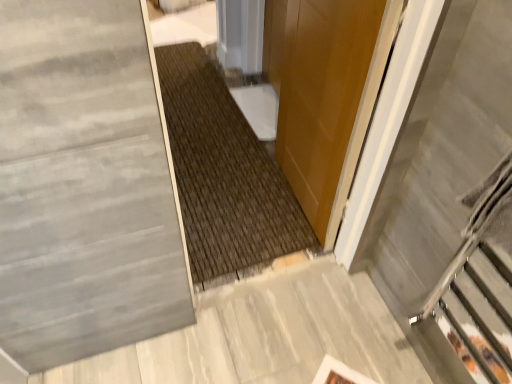
Measure the distance between point (298, 281) and camera.

The depth of point (298, 281) is 1.65 meters.

The image size is (512, 384). What do you see at coordinates (325, 93) in the screenshot?
I see `glossy wood door at center` at bounding box center [325, 93].

The height and width of the screenshot is (384, 512). Identify the location of metallic gray escalator at right. (451, 202).

Which is in front, metallic gray escalator at right or glossy wood door at center?

metallic gray escalator at right is in front.

What's the angular difference between metallic gray escalator at right and glossy wood door at center's facing directions?

The facing directions of metallic gray escalator at right and glossy wood door at center are 2.09 degrees apart.

From a real-world perspective, does metallic gray escalator at right sit lower than glossy wood door at center?

Incorrect, from a real-world perspective, metallic gray escalator at right is higher than glossy wood door at center.

Is there a large distance between metallic gray escalator at right and glossy wood door at center?

Actually, metallic gray escalator at right and glossy wood door at center are a little close together.

From a real-world perspective, does metallic gray escalator at right stand above gray polished concrete at lower left?

Yes, from a real-world perspective, metallic gray escalator at right is above gray polished concrete at lower left.

Relative to gray polished concrete at lower left, is metallic gray escalator at right in front or behind?

Clearly, metallic gray escalator at right is in front of gray polished concrete at lower left.

Considering the sizes of metallic gray escalator at right and gray polished concrete at lower left in the image, is metallic gray escalator at right bigger or smaller than gray polished concrete at lower left?

metallic gray escalator at right is bigger than gray polished concrete at lower left.

Is gray polished concrete at lower left oriented towards metallic gray escalator at right?

No, gray polished concrete at lower left is not turned towards metallic gray escalator at right.

Is gray polished concrete at lower left positioned far away from metallic gray escalator at right?

Actually, gray polished concrete at lower left and metallic gray escalator at right are a little close together.

Does gray polished concrete at lower left come behind metallic gray escalator at right?

That is True.

From a real-world perspective, is gray polished concrete at lower left physically above metallic gray escalator at right?

No, from a real-world perspective, gray polished concrete at lower left is not on top of metallic gray escalator at right.

From a real-world perspective, between glossy wood door at center and metallic gray escalator at right, who is vertically higher?

metallic gray escalator at right, from a real-world perspective.

Can you confirm if glossy wood door at center is shorter than metallic gray escalator at right?

No, glossy wood door at center is not shorter than metallic gray escalator at right.

Which of these two, glossy wood door at center or metallic gray escalator at right, is smaller?

With smaller size is metallic gray escalator at right.

Is glossy wood door at center spatially inside metallic gray escalator at right, or outside of it?

glossy wood door at center is spatially situated outside metallic gray escalator at right.

From a real-world perspective, is glossy wood door at center physically above gray polished concrete at lower left?

Yes, from a real-world perspective, glossy wood door at center is over gray polished concrete at lower left

Does glossy wood door at center touch gray polished concrete at lower left?

No, glossy wood door at center is not in contact with gray polished concrete at lower left.

Between glossy wood door at center and gray polished concrete at lower left, which one has less height?

Standing shorter between the two is gray polished concrete at lower left.

Is gray polished concrete at lower left a part of glossy wood door at center?

No, gray polished concrete at lower left is not surrounded by glossy wood door at center.

Is gray polished concrete at lower left positioned beyond the bounds of glossy wood door at center?

Absolutely, gray polished concrete at lower left is external to glossy wood door at center.

Which of these two, gray polished concrete at lower left or glossy wood door at center, is thinner?

Thinner between the two is glossy wood door at center.

Between gray polished concrete at lower left and glossy wood door at center, which one has smaller size?

gray polished concrete at lower left is smaller.

Is the surface of gray polished concrete at lower left in direct contact with glossy wood door at center?

No.

What are the coordinates of `escalator that is above the glossy wood door at center (from a real-world perspective)` in the screenshot? It's located at (451, 202).

In order to click on escalator in front of the gray polished concrete at lower left in this screenshot , I will do `click(451, 202)`.

Looking at the image, which one is located closer to gray polished concrete at lower left, glossy wood door at center or metallic gray escalator at right?

metallic gray escalator at right lies closer to gray polished concrete at lower left than the other object.

When comparing their distances from glossy wood door at center, does metallic gray escalator at right or gray polished concrete at lower left seem further?

gray polished concrete at lower left.

Looking at the image, which one is located further to gray polished concrete at lower left, metallic gray escalator at right or glossy wood door at center?

Among the two, glossy wood door at center is located further to gray polished concrete at lower left.

Estimate the real-world distances between objects in this image. Which object is closer to metallic gray escalator at right, glossy wood door at center or gray polished concrete at lower left?

Based on the image, glossy wood door at center appears to be nearer to metallic gray escalator at right.

Based on the photo, considering their positions, is gray polished concrete at lower left positioned further to metallic gray escalator at right than glossy wood door at center?

gray polished concrete at lower left lies further to metallic gray escalator at right than the other object.

In the scene shown: Based on their spatial positions, is gray polished concrete at lower left or metallic gray escalator at right closer to glossy wood door at center?

metallic gray escalator at right.

Identify the location of escalator between glossy wood door at center and gray polished concrete at lower left in the vertical direction. The width and height of the screenshot is (512, 384). (451, 202).